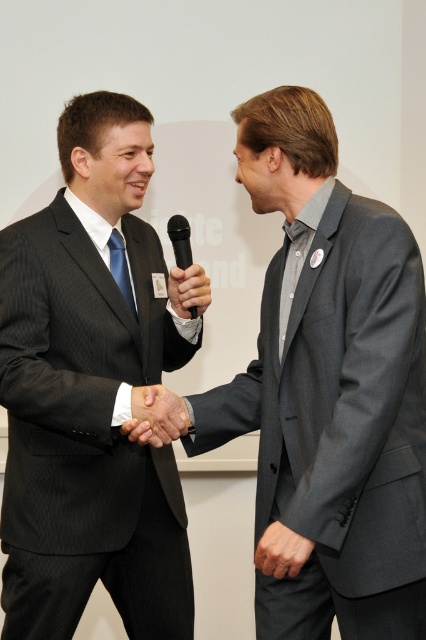
Question: Does smooth gray suit at center appear over black matte microphone at center?

Choices:
 (A) no
 (B) yes

Answer: (A)

Question: Can you confirm if matte black suit at center is smaller than black matte microphone at center?

Choices:
 (A) no
 (B) yes

Answer: (A)

Question: Which point appears farthest from the camera in this image?

Choices:
 (A) (173, 291)
 (B) (287, 460)
 (C) (60, 381)
 (D) (149, 396)

Answer: (A)

Question: Which point is closer to the camera?

Choices:
 (A) (186, 429)
 (B) (189, 225)
 (C) (34, 552)
 (D) (298, 557)

Answer: (D)

Question: In this image, where is gray pinstripe suit at center located relative to smooth gray suit at center?

Choices:
 (A) right
 (B) left

Answer: (A)

Question: Which of these objects is positioned closest to the black plastic microphone at center?

Choices:
 (A) matte black suit at center
 (B) gray pinstripe suit at center

Answer: (A)